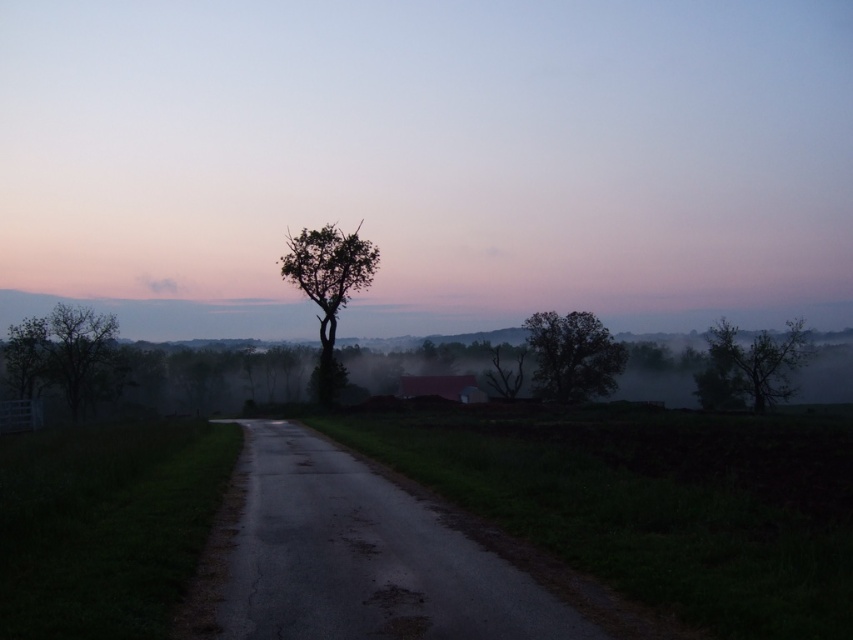
Question: Which object is the closest to the green leafy tree at center?

Choices:
 (A) smooth bark tree at right
 (B) silhouette leafy tree at center
 (C) silhouette tree at center

Answer: (B)

Question: Among these objects, which one is nearest to the camera?

Choices:
 (A) green leafy tree at center
 (B) smooth bark tree at right
 (C) silhouette tree at center

Answer: (A)

Question: Is silhouette tree at center wider than silhouette leafy tree at center?

Choices:
 (A) no
 (B) yes

Answer: (B)

Question: Estimate the real-world distances between objects in this image. Which object is closer to the smooth bark tree at right?

Choices:
 (A) silhouette leafy tree at center
 (B) green leafy tree at center
 (C) silhouette tree at center

Answer: (A)

Question: Is green leafy tree at center wider than silhouette leafy tree at center?

Choices:
 (A) no
 (B) yes

Answer: (B)

Question: Does silhouette tree at center appear over silhouette leafy tree at center?

Choices:
 (A) no
 (B) yes

Answer: (B)